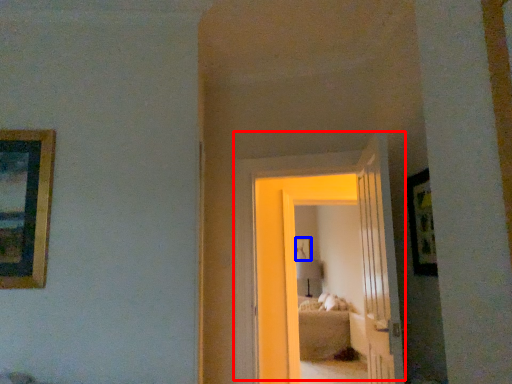
Question: Which object is closer to the camera taking this photo, door (highlighted by a red box) or picture frame (highlighted by a blue box)?

Choices:
 (A) door
 (B) picture frame

Answer: (A)